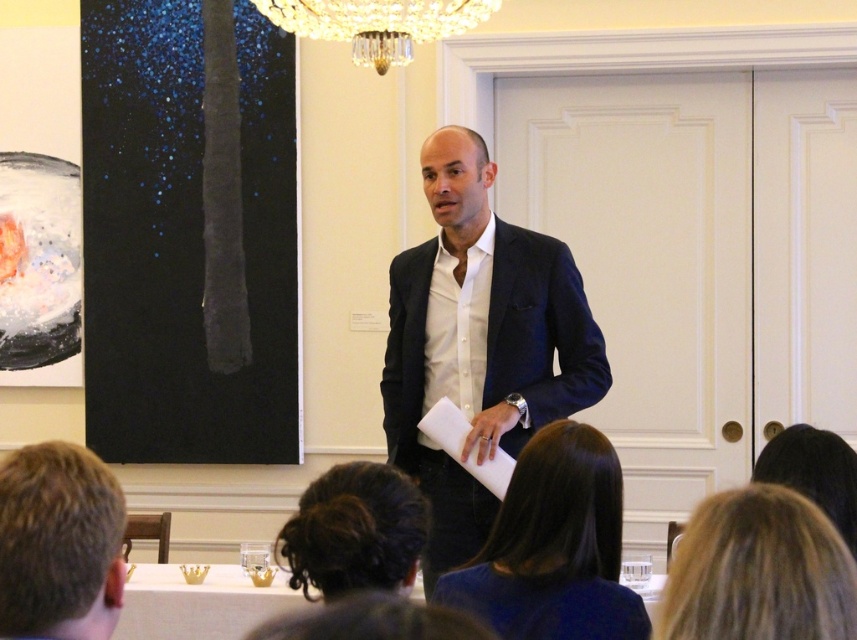
Based on the scene description, which object is taller between the matte black suit at center and the dark brown hair at lower center?

The matte black suit at center is taller than the dark brown hair at lower center according to the description.

You are an event planner setting up a camera to capture the speaker and the audience. You need to position the camera so that the dark brown hair at lower center and the crystal glass chandelier at upper center are both visible. Based on their positions, which object should be closer to the camera?

The crystal glass chandelier at upper center should be closer to the camera because the dark brown hair at lower center is behind it.